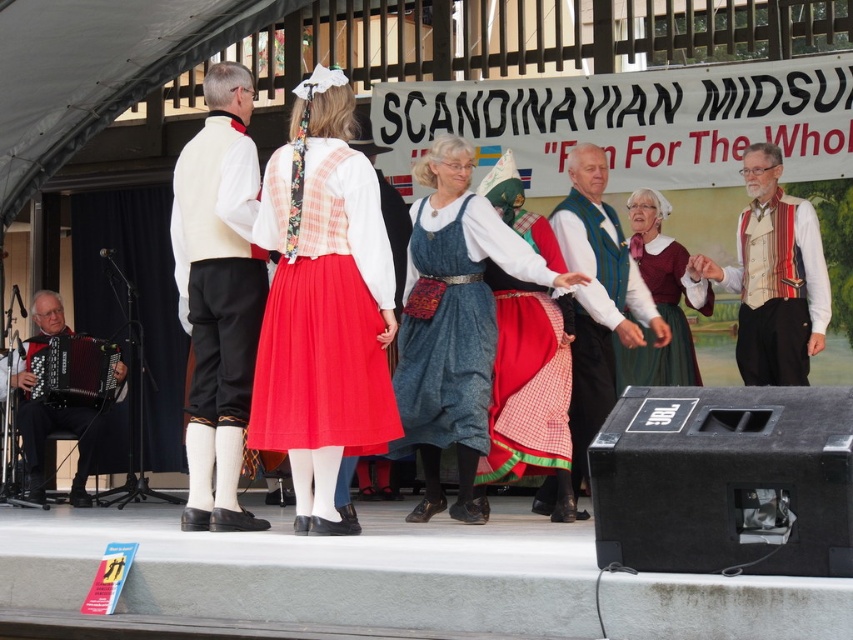
You are a photographer at the Scandinavian Midsummer event. You want to take a photo of the white cotton vest at center and the black leather accordion at left. From your current position, which object is closer to you?

The white cotton vest at center is closer to you because it is in front of the black leather accordion at left.

You are organizing a storage area and need to place the white cotton vest at center and the black leather accordion at left. Which item requires more space to store?

The black leather accordion at left requires more space to store because the white cotton vest at center occupies less space than it.